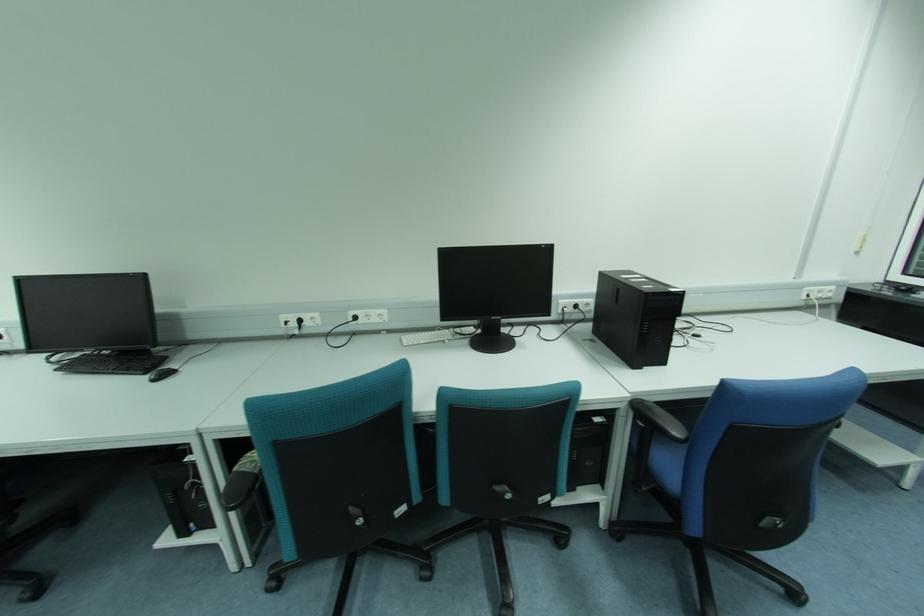
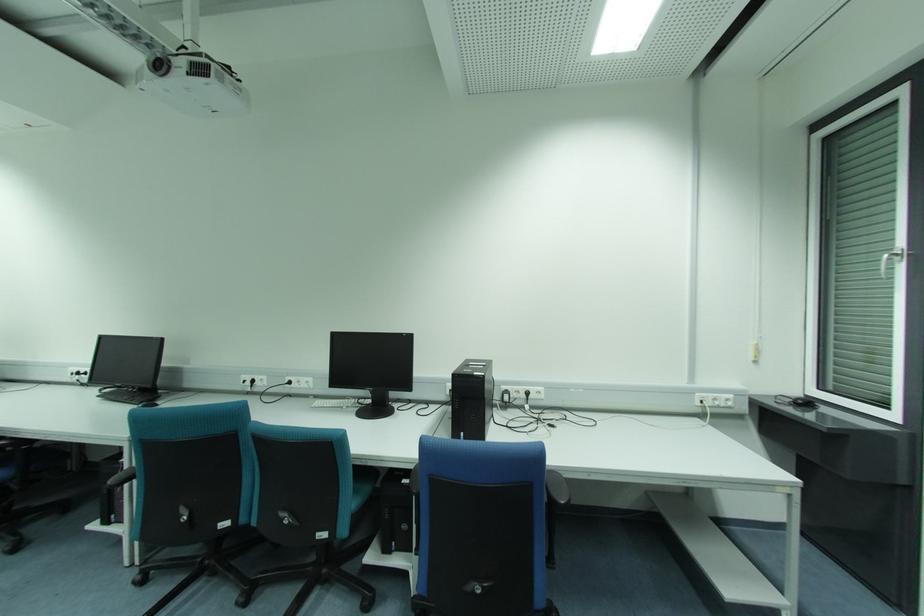
In the second image, find the point that corresponds to [356,318] in the first image.

(289, 383)